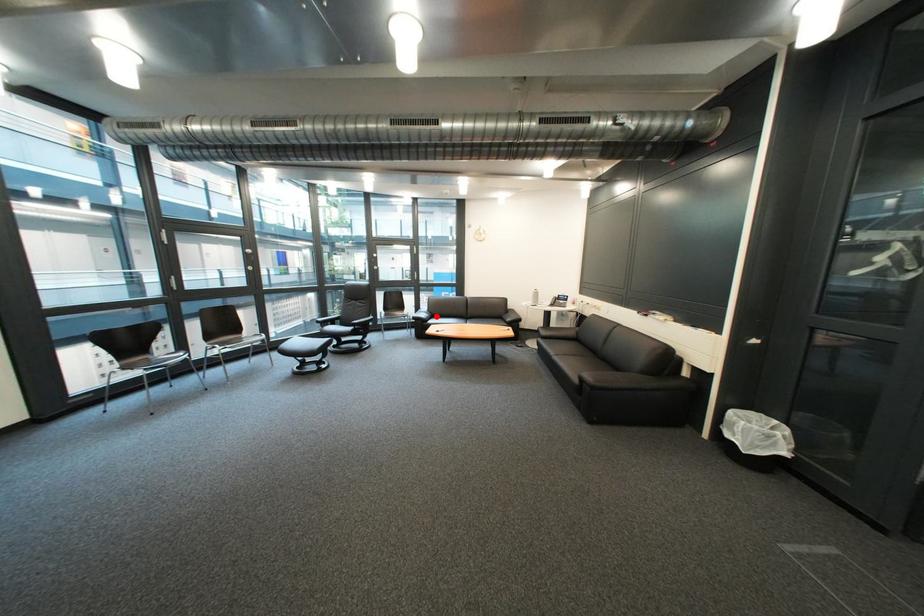
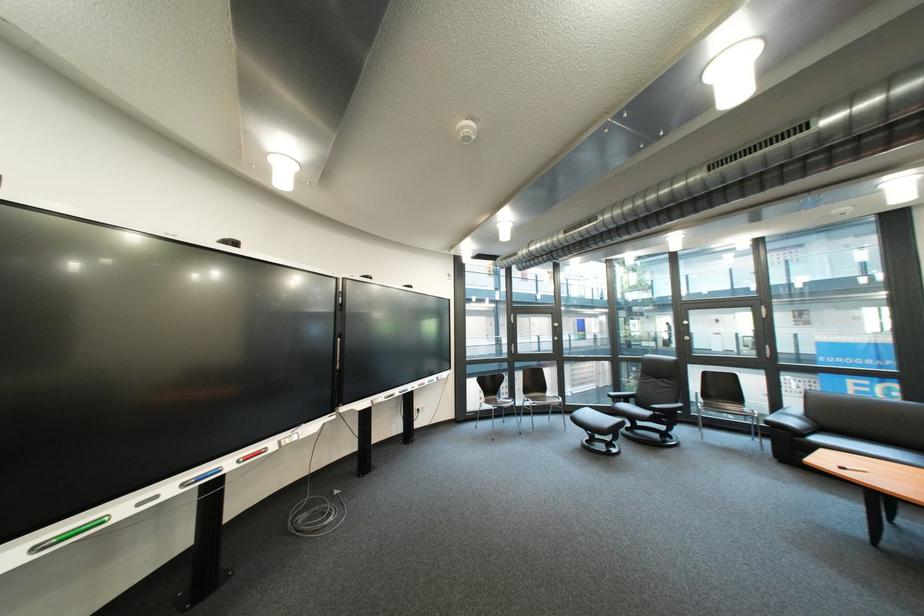
The point at the highlighted location is marked in the first image. Where is the corresponding point in the second image?

(806, 423)